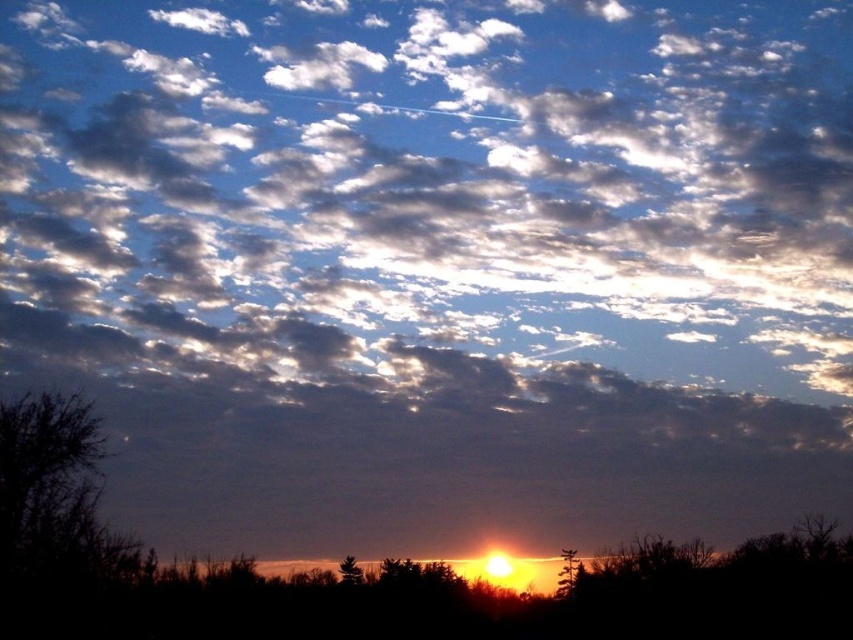
Question: Does brown textured tree at lower center have a lesser width compared to silvery textured pine tree at center?

Choices:
 (A) no
 (B) yes

Answer: (A)

Question: Can you confirm if brown textured tree at lower center is smaller than silvery textured pine tree at center?

Choices:
 (A) yes
 (B) no

Answer: (B)

Question: Does brown textured tree at lower center have a lesser width compared to silvery textured pine tree at center?

Choices:
 (A) no
 (B) yes

Answer: (A)

Question: Which of the following is the closest to the observer?

Choices:
 (A) silvery textured pine tree at center
 (B) brown textured tree at lower center

Answer: (A)